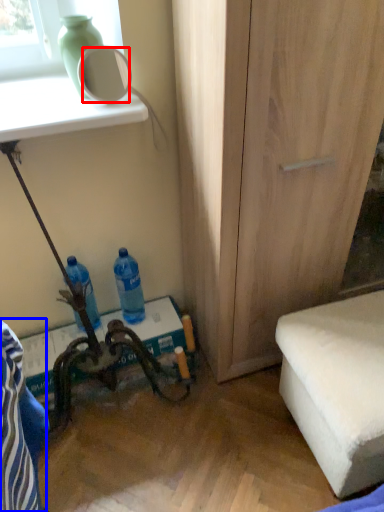
Question: Which object appears closest to the camera in this image, mirror (highlighted by a red box) or swivel chair (highlighted by a blue box)?

Choices:
 (A) mirror
 (B) swivel chair

Answer: (B)